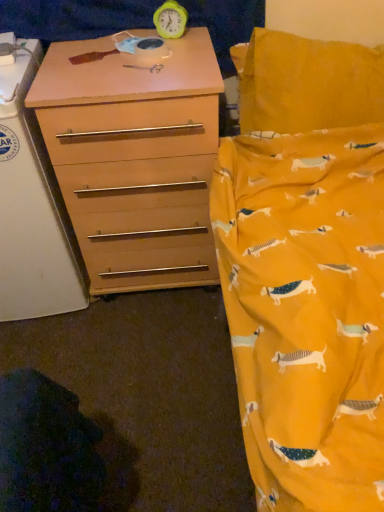
Question: In terms of size, does matte wood changing table at left appear bigger or smaller than matte wood chest of drawers at left?

Choices:
 (A) small
 (B) big

Answer: (A)

Question: From their relative heights in the image, would you say matte wood changing table at left is taller or shorter than matte wood chest of drawers at left?

Choices:
 (A) tall
 (B) short

Answer: (A)

Question: Estimate the real-world distances between objects in this image. Which object is closer to the matte wood chest of drawers at left?

Choices:
 (A) matte wood changing table at left
 (B) green plastic clock at upper center

Answer: (A)

Question: Which object is positioned farthest from the green plastic clock at upper center?

Choices:
 (A) matte wood chest of drawers at left
 (B) matte wood changing table at left

Answer: (B)